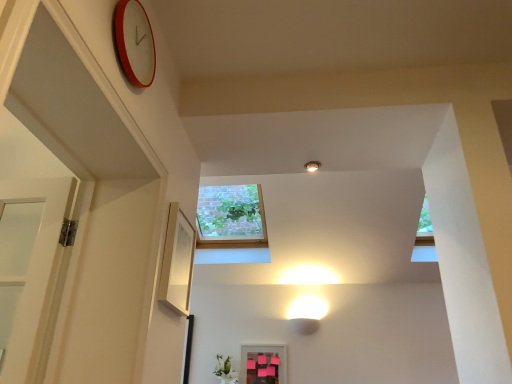
Question: Can you see white glossy light fixture at upper center touching pink matte picture frame at lower center, the 2th picture frame positioned from the left?

Choices:
 (A) yes
 (B) no

Answer: (B)

Question: From a real-world perspective, is white glossy light fixture at upper center on top of pink matte picture frame at lower center, which ranks as the first picture frame in back-to-front order?

Choices:
 (A) no
 (B) yes

Answer: (B)

Question: Is white glossy light fixture at upper center oriented away from pink matte picture frame at lower center, which is counted as the first picture frame, starting from the right?

Choices:
 (A) yes
 (B) no

Answer: (B)

Question: Can you confirm if white glossy light fixture at upper center is smaller than pink matte picture frame at lower center, which is counted as the first picture frame, starting from the right?

Choices:
 (A) no
 (B) yes

Answer: (B)

Question: From a real-world perspective, is white glossy light fixture at upper center positioned under pink matte picture frame at lower center, which is counted as the first picture frame, starting from the right, based on gravity?

Choices:
 (A) yes
 (B) no

Answer: (B)

Question: From the image's perspective, would you say white glossy light fixture at upper center is shown under pink matte picture frame at lower center, which appears as the 2th picture frame when viewed from the front?

Choices:
 (A) no
 (B) yes

Answer: (A)

Question: Is matte white picture frame at center-left, which is the second picture frame from right to left, positioned in front of pink matte picture frame at lower center, which is counted as the first picture frame, starting from the right?

Choices:
 (A) yes
 (B) no

Answer: (A)

Question: Does matte white picture frame at center-left, arranged as the 2th picture frame when viewed from the back, have a greater height compared to pink matte picture frame at lower center, which appears as the 2th picture frame when viewed from the front?

Choices:
 (A) no
 (B) yes

Answer: (A)

Question: Does matte white picture frame at center-left, which is counted as the 2th picture frame, starting from the bottom, have a lesser width compared to pink matte picture frame at lower center, which is counted as the first picture frame, starting from the right?

Choices:
 (A) yes
 (B) no

Answer: (B)

Question: Considering the relative sizes of matte white picture frame at center-left, which is the first picture frame from top to bottom, and pink matte picture frame at lower center, which is counted as the first picture frame, starting from the right, in the image provided, is matte white picture frame at center-left, which is the first picture frame from top to bottom, wider than pink matte picture frame at lower center, which is counted as the first picture frame, starting from the right,?

Choices:
 (A) yes
 (B) no

Answer: (A)

Question: From the image's perspective, is matte white picture frame at center-left, which is the second picture frame from right to left, above pink matte picture frame at lower center, the 2th picture frame from the top?

Choices:
 (A) no
 (B) yes

Answer: (B)

Question: Is the depth of matte white picture frame at center-left, which is the first picture frame from top to bottom, greater than that of pink matte picture frame at lower center, arranged as the 1th picture frame when ordered from the bottom?

Choices:
 (A) no
 (B) yes

Answer: (A)

Question: Is white glossy light fixture at upper center far from green matte vase at lower center?

Choices:
 (A) yes
 (B) no

Answer: (A)